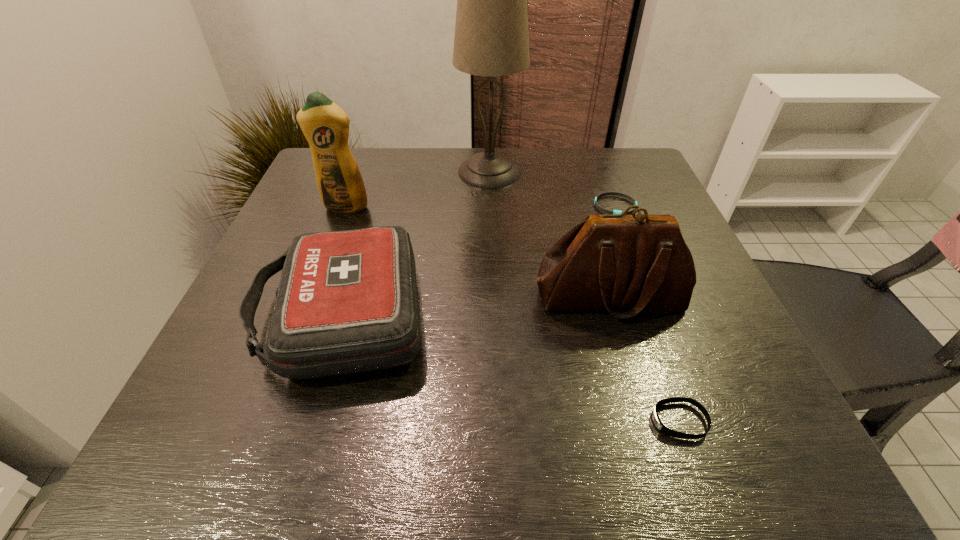
The height and width of the screenshot is (540, 960). I want to click on free space at the far left corner of the desktop, so click(376, 157).

Image resolution: width=960 pixels, height=540 pixels. What are the coordinates of `free region at the far right corner of the desktop` in the screenshot? It's located at coord(583,151).

Where is `vacant space that is in between the shorter wristband and the detergent`? The width and height of the screenshot is (960, 540). vacant space that is in between the shorter wristband and the detergent is located at coordinates (480, 207).

What are the coordinates of `unoccupied position between the fifth tallest object and the detergent` in the screenshot? It's located at (513, 314).

Locate an element on the screen. The height and width of the screenshot is (540, 960). empty space that is in between the first-aid kit and the shorter wristband is located at coordinates (478, 261).

This screenshot has width=960, height=540. Identify the location of blank region between the taller wristband and the first-aid kit. (511, 368).

Identify the location of vacant space that's between the first-aid kit and the lampshade. (416, 244).

Identify the location of free space between the taller wristband and the shoulder bag. This screenshot has height=540, width=960. (645, 359).

Find the location of a particular element. vacant space that is in between the lampshade and the second tallest object is located at coordinates (418, 190).

Where is `empty space that is in between the shorter wristband and the farthest object`? The image size is (960, 540). empty space that is in between the shorter wristband and the farthest object is located at coordinates (552, 189).